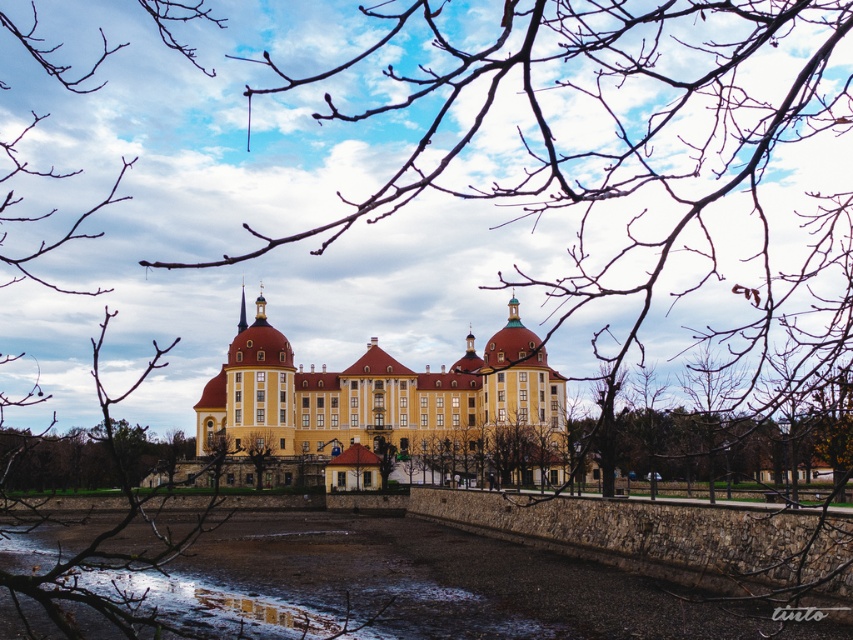
You are standing at the entrance of the grand building and notice a glossy concrete puddle at lower center and a green leafy tree at center. Which object is closer to you, the observer?

The glossy concrete puddle at lower center is closer to you than the green leafy tree at center because they are 23.29 meters apart from each other.

You are an architect analyzing the composition of this scene. Based on the positioning of the yellow matte building at center and the green leafy tree at center, which object appears closer to the viewer?

The yellow matte building at center is in front of the green leafy tree at center, so it appears closer to the viewer.

In the scene shown: You are an architect analyzing the composition of the image. Based on the positioning of the yellow matte building at center and the green leafy tree at center, which one appears closer to the viewer?

The green leafy tree at center appears closer to the viewer because the yellow matte building at center is positioned above it, indicating depth through overlapping.